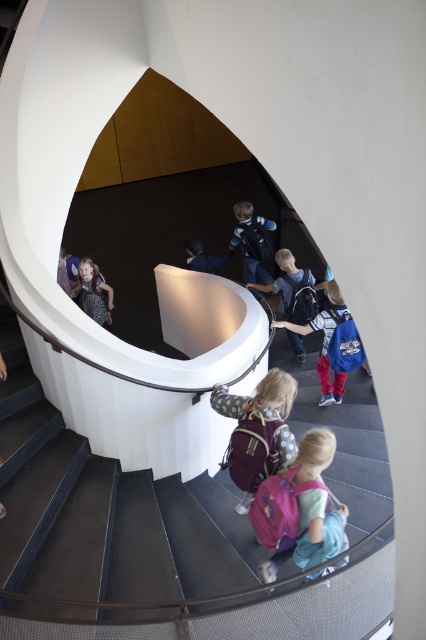
Which is above, pink fabric backpack at lower center or dark blue backpack at center?

dark blue backpack at center is above.

Where is `pink fabric backpack at lower center`? This screenshot has height=640, width=426. pink fabric backpack at lower center is located at coordinates (310, 534).

Is point (271, 556) positioned before point (290, 285)?

Yes.

The height and width of the screenshot is (640, 426). I want to click on pink fabric backpack at lower center, so click(x=310, y=534).

Is blue backpack at center in front of matte black backpack at lower center?

Yes.

Does blue backpack at center have a lesser width compared to matte black backpack at lower center?

No, blue backpack at center is not thinner than matte black backpack at lower center.

Measure the distance between point (342, 378) and camera.

4.43 meters

The height and width of the screenshot is (640, 426). I want to click on blue backpack at center, so click(325, 340).

Who is positioned more to the left, dark blue backpack at center or blue backpack at center?

Positioned to the left is dark blue backpack at center.

Locate an element on the screen. Image resolution: width=426 pixels, height=640 pixels. dark blue backpack at center is located at coordinates (293, 289).

Who is more distant from viewer, (298, 356) or (325, 392)?

Positioned behind is point (298, 356).

Where is `dark blue backpack at center`? The image size is (426, 640). dark blue backpack at center is located at coordinates (293, 289).